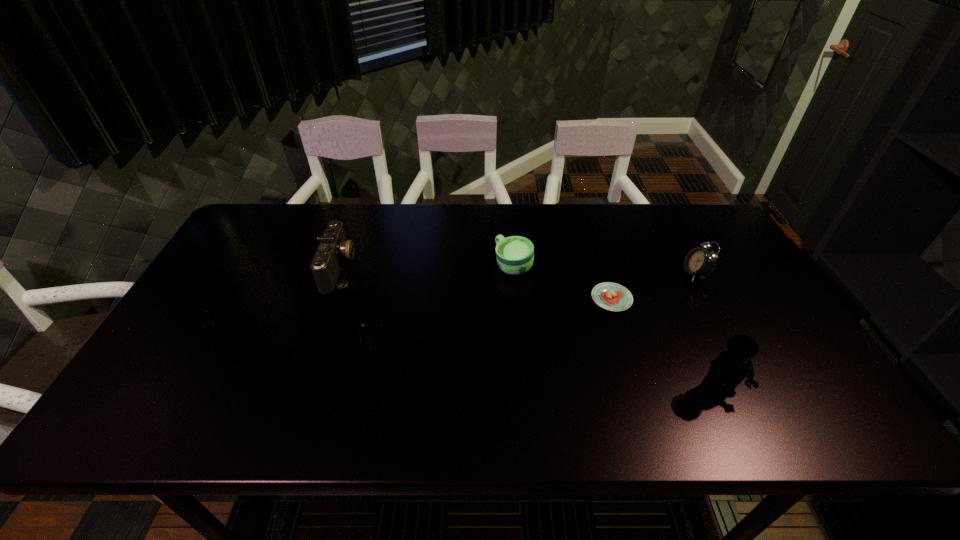
Where is `Lego that is the second closest one to the nearest object`? The image size is (960, 540). Lego that is the second closest one to the nearest object is located at coordinates (212, 318).

Locate an element on the screen. The height and width of the screenshot is (540, 960). free region that satisfies the following two spatial constraints: 1. on the front-facing side of the camera; 2. on the back side of the shortest object is located at coordinates [329, 299].

The width and height of the screenshot is (960, 540). Identify the location of vacant point that satisfies the following two spatial constraints: 1. on the front side of the sixth tallest object; 2. on the right side of the third object from right to left. (516, 299).